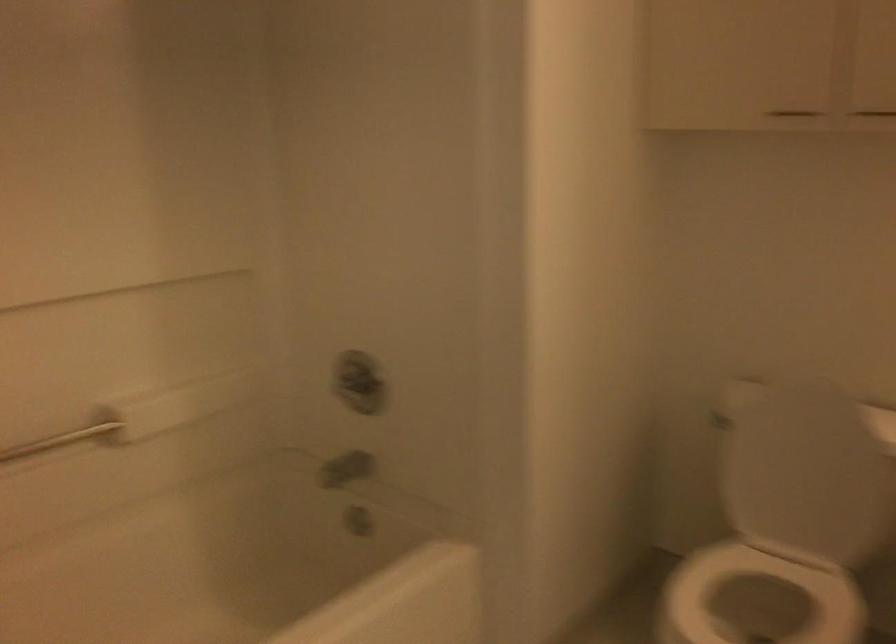
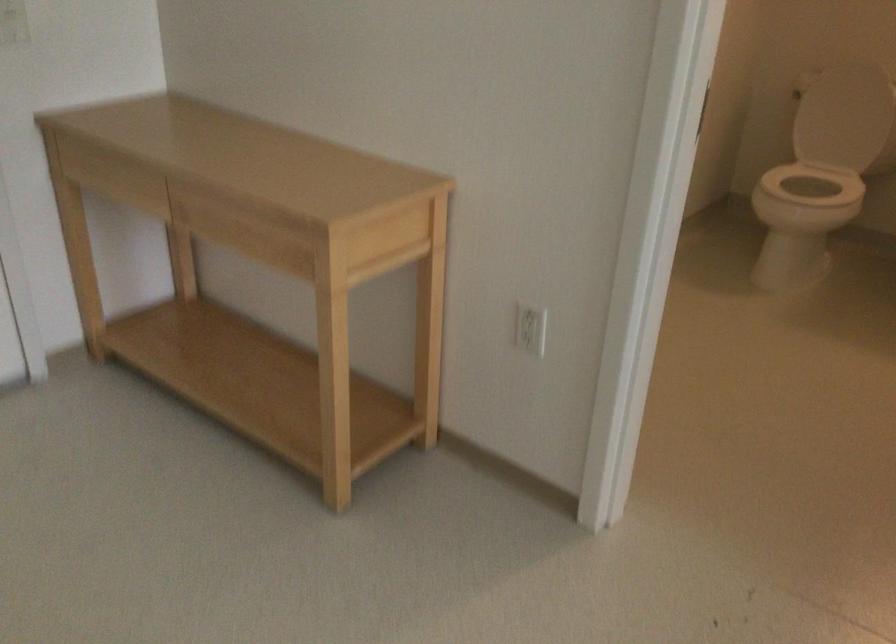
In the second image, find the point that corresponds to the point at 756,496 in the first image.

(839, 118)